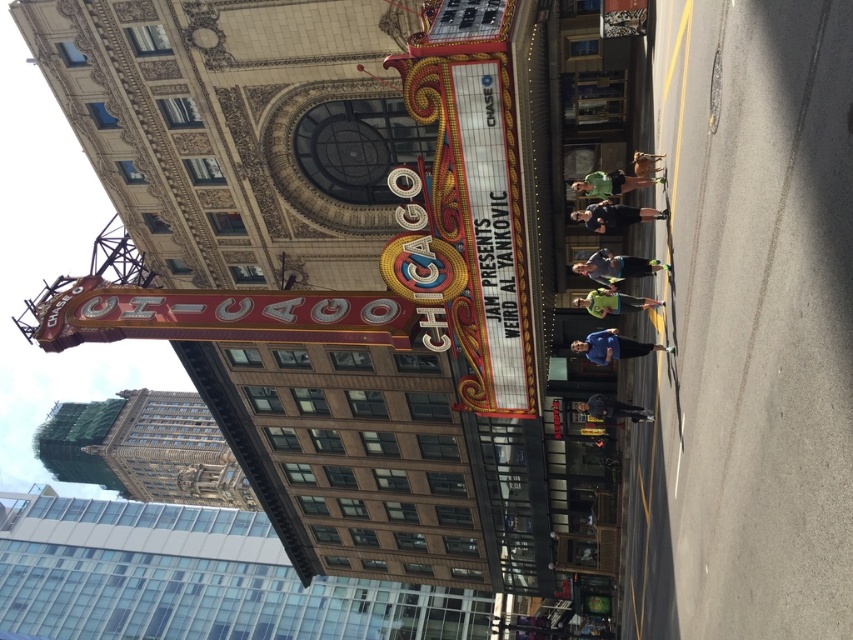
You are standing in front of the Chicago Theatre and see two shirts displayed on mannequins at the center of the marquee. The shirts are both at the center. Which shirt is positioned lower on the marquee? The options are the blue fabric shirt at center and the green fabric shirt at center.

The blue fabric shirt at center is located below the green fabric shirt at center, so the blue fabric shirt at center is positioned lower on the marquee.

You are attending a concert at the Chicago Theatre and wearing a green fabric shirt at center and dark gray pants at center. If you want to ensure your outfit is balanced, which clothing item should you adjust to match the other in terms of width?

The green fabric shirt at center is wider than the dark gray pants at center. To balance your outfit, you should adjust the width of the green fabric shirt at center to match the narrower dark gray pants at center.